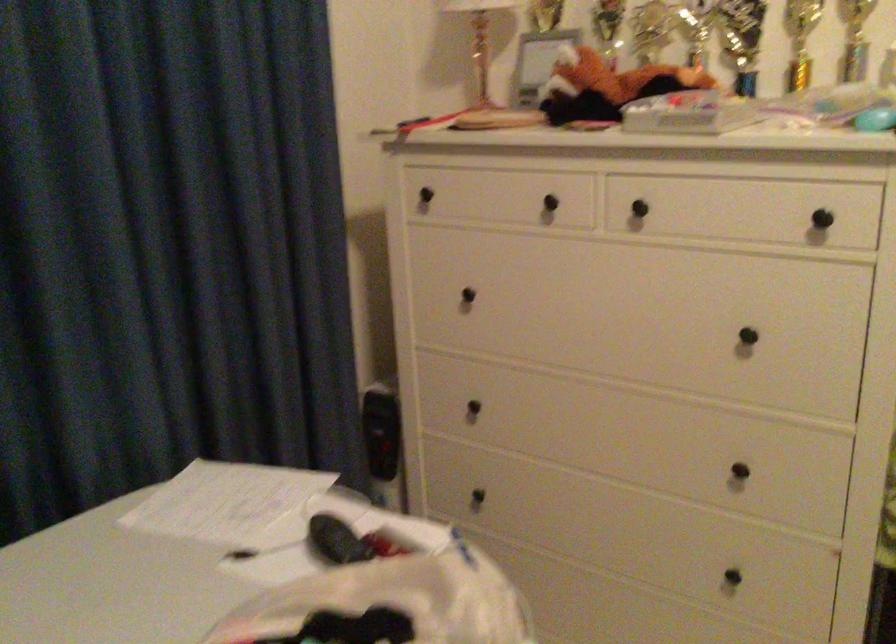
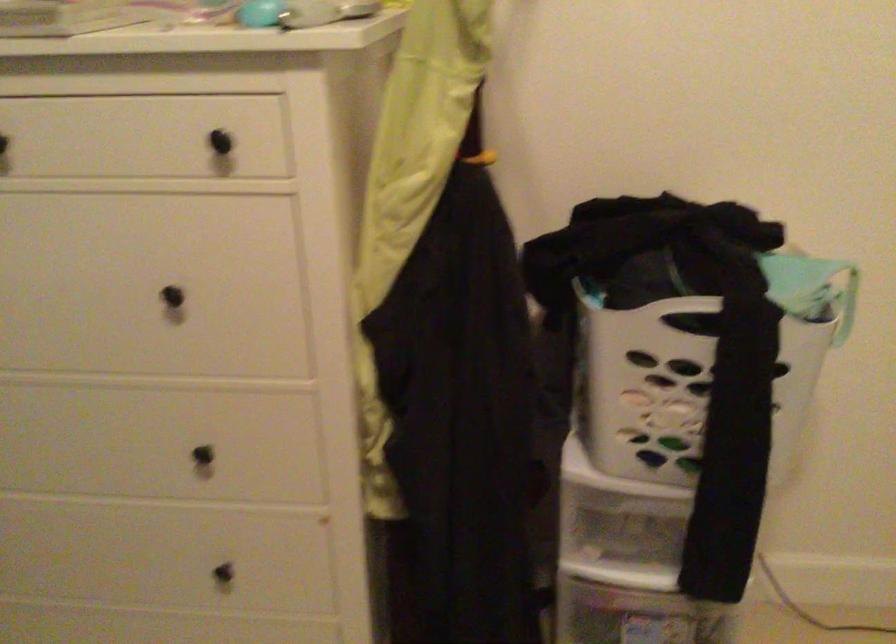
The point at (736, 573) is marked in the first image. Where is the corresponding point in the second image?

(226, 564)